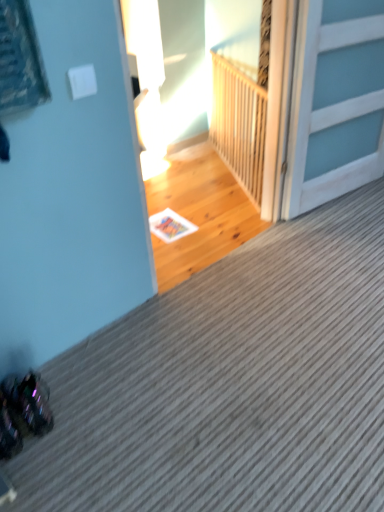
Question: Is wooden at upper center aimed at white wooden door at upper right?

Choices:
 (A) yes
 (B) no

Answer: (B)

Question: Would you say wooden at upper center contains white wooden door at upper right?

Choices:
 (A) yes
 (B) no

Answer: (B)

Question: From a real-world perspective, is wooden at upper center over white wooden door at upper right?

Choices:
 (A) yes
 (B) no

Answer: (B)

Question: From a real-world perspective, is wooden at upper center positioned under white wooden door at upper right based on gravity?

Choices:
 (A) no
 (B) yes

Answer: (B)

Question: Considering the relative sizes of wooden at upper center and white wooden door at upper right in the image provided, is wooden at upper center thinner than white wooden door at upper right?

Choices:
 (A) no
 (B) yes

Answer: (B)

Question: Is wooden at upper center at the left side of white wooden door at upper right?

Choices:
 (A) no
 (B) yes

Answer: (B)

Question: Can you confirm if white wooden door at upper right is shorter than wooden at upper center?

Choices:
 (A) yes
 (B) no

Answer: (B)

Question: Is white wooden door at upper right next to wooden at upper center?

Choices:
 (A) no
 (B) yes

Answer: (A)

Question: From a real-world perspective, is white wooden door at upper right below wooden at upper center?

Choices:
 (A) yes
 (B) no

Answer: (B)

Question: From a real-world perspective, is white wooden door at upper right physically above wooden at upper center?

Choices:
 (A) no
 (B) yes

Answer: (B)

Question: Is white wooden door at upper right at the left side of wooden at upper center?

Choices:
 (A) no
 (B) yes

Answer: (A)

Question: Does white wooden door at upper right have a lesser width compared to wooden at upper center?

Choices:
 (A) no
 (B) yes

Answer: (A)

Question: Is white wooden door at upper right situated inside wooden at upper center or outside?

Choices:
 (A) outside
 (B) inside

Answer: (A)